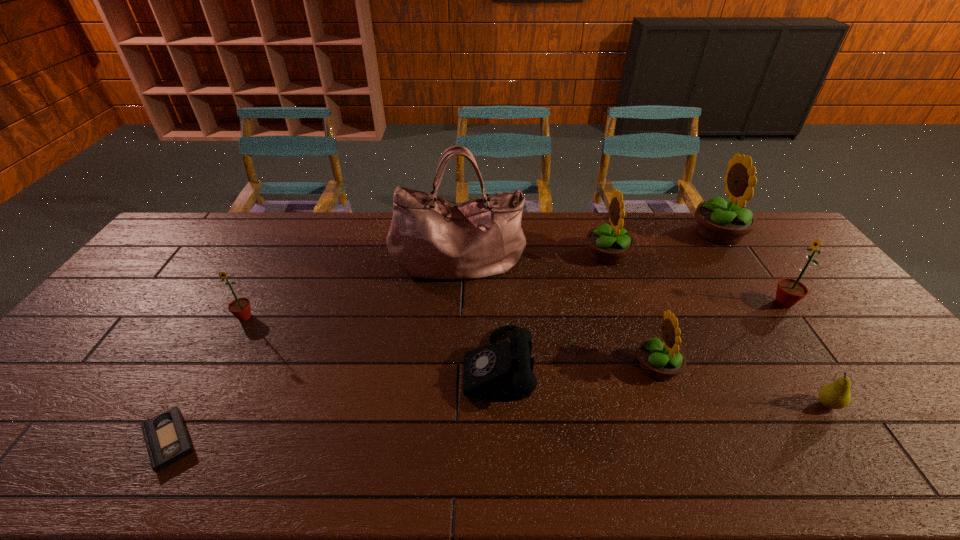
The width and height of the screenshot is (960, 540). What are the coordinates of `vacant space located 0.400m on the face of the bigger green sunflower` in the screenshot? It's located at (637, 303).

This screenshot has width=960, height=540. Find the location of `vacant space located on the face of the bigger green sunflower`. vacant space located on the face of the bigger green sunflower is located at coordinates (701, 303).

This screenshot has height=540, width=960. I want to click on vacant space located on the face of the smallest yellow sunflower, so click(x=596, y=367).

Find the location of a particular element. blank space located on the face of the smallest yellow sunflower is located at coordinates (531, 367).

Locate an element on the screen. This screenshot has width=960, height=540. vacant space located 0.100m on the face of the smallest yellow sunflower is located at coordinates (596, 367).

Find the location of a particular element. free region located 0.290m on the face of the smaller green sunflower is located at coordinates pyautogui.click(x=191, y=414).

Find the location of a particular element. Image resolution: width=960 pixels, height=540 pixels. vacant point located on the left of the pear is located at coordinates coord(778,404).

The width and height of the screenshot is (960, 540). Find the location of `free space located on the dial of the telephone`. free space located on the dial of the telephone is located at coordinates tap(380, 367).

Locate an element on the screen. Image resolution: width=960 pixels, height=540 pixels. blank space located 0.210m on the dial of the telephone is located at coordinates (384, 367).

Where is `free spot located on the dial of the telephone`? The height and width of the screenshot is (540, 960). free spot located on the dial of the telephone is located at coordinates (396, 367).